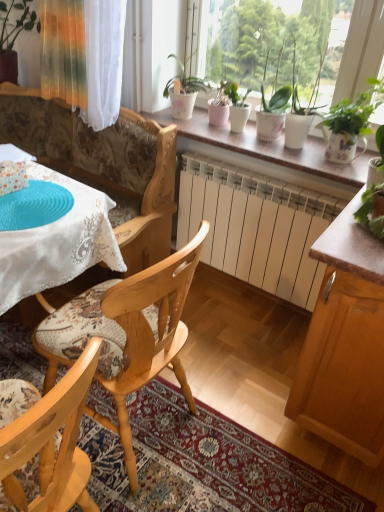
Question: Is light wood chair at center, which ranks as the second chair in front-to-back order, bigger than translucent glass vase at upper left, which is counted as the third houseplant, starting from the front?

Choices:
 (A) no
 (B) yes

Answer: (B)

Question: Can you confirm if light wood chair at center, the first chair in the back-to-front sequence, is smaller than translucent glass vase at upper left, the first houseplant viewed from the back?

Choices:
 (A) yes
 (B) no

Answer: (B)

Question: Can translucent glass vase at upper left, which is counted as the third houseplant, starting from the front, be found inside light wood chair at center, which ranks as the second chair in front-to-back order?

Choices:
 (A) yes
 (B) no

Answer: (B)

Question: Is light wood chair at center, which ranks as the second chair in front-to-back order, far away from translucent glass vase at upper left, positioned as the 3th houseplant in bottom-to-top order?

Choices:
 (A) no
 (B) yes

Answer: (B)

Question: From a real-world perspective, is light wood chair at center, which ranks as the second chair in front-to-back order, on top of translucent glass vase at upper left, positioned as the 3th houseplant in bottom-to-top order?

Choices:
 (A) yes
 (B) no

Answer: (B)

Question: From their relative heights in the image, would you say white ceramic pot at upper right, which ranks as the first houseplant in front-to-back order, is taller or shorter than white ceramic pots at center?

Choices:
 (A) tall
 (B) short

Answer: (A)

Question: Is white ceramic pot at upper right, the 3th houseplant positioned from the top, wider or thinner than white ceramic pots at center?

Choices:
 (A) thin
 (B) wide

Answer: (A)

Question: From a real-world perspective, is white ceramic pot at upper right, the 3th houseplant positioned from the top, physically located above or below white ceramic pots at center?

Choices:
 (A) below
 (B) above

Answer: (B)

Question: Visually, is white ceramic pot at upper right, the 3th houseplant positioned from the top, positioned to the left or to the right of white ceramic pots at center?

Choices:
 (A) right
 (B) left

Answer: (A)

Question: Considering the positions of point (312, 479) and point (342, 130), is point (312, 479) closer or farther from the camera than point (342, 130)?

Choices:
 (A) closer
 (B) farther

Answer: (A)

Question: In terms of size, does wooden placemat at lower center appear bigger or smaller than white ceramic pot at upper right, which ranks as the first houseplant in front-to-back order?

Choices:
 (A) big
 (B) small

Answer: (B)

Question: From the image's perspective, is wooden placemat at lower center above or below white ceramic pot at upper right, the 3th houseplant positioned from the top?

Choices:
 (A) below
 (B) above

Answer: (A)

Question: In the image, is wooden placemat at lower center on the left side or the right side of white ceramic pot at upper right, the 3th houseplant positioned from the top?

Choices:
 (A) right
 (B) left

Answer: (B)

Question: From a real-world perspective, relative to matte white pot at center, acting as the 2th houseplant starting from the back, is light wood chair at center, positioned as the 1th chair in front-to-back order, vertically above or below?

Choices:
 (A) below
 (B) above

Answer: (A)

Question: From the image's perspective, is light wood chair at center, which appears as the second chair when viewed from the back, above or below matte white pot at center, which ranks as the 2th houseplant in bottom-to-top order?

Choices:
 (A) above
 (B) below

Answer: (B)